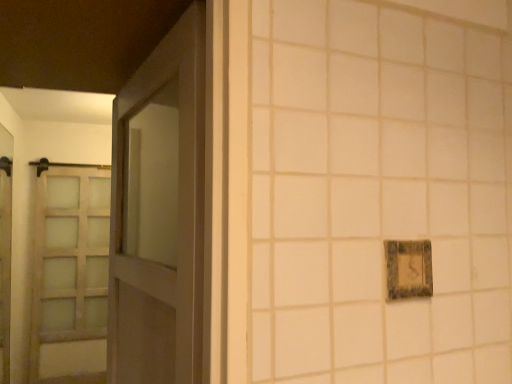
Question: From the image's perspective, would you say rustic stone picture frame at right is positioned over matte glass elevator at left?

Choices:
 (A) no
 (B) yes

Answer: (B)

Question: Is rustic stone picture frame at right not near matte glass elevator at left?

Choices:
 (A) no
 (B) yes

Answer: (B)

Question: Considering the relative sizes of rustic stone picture frame at right and matte glass elevator at left in the image provided, is rustic stone picture frame at right thinner than matte glass elevator at left?

Choices:
 (A) yes
 (B) no

Answer: (A)

Question: From a real-world perspective, is rustic stone picture frame at right below matte glass elevator at left?

Choices:
 (A) yes
 (B) no

Answer: (B)

Question: Is rustic stone picture frame at right further to camera compared to matte glass elevator at left?

Choices:
 (A) no
 (B) yes

Answer: (A)

Question: Can you confirm if rustic stone picture frame at right is shorter than matte glass elevator at left?

Choices:
 (A) no
 (B) yes

Answer: (B)

Question: Is matte wood door at left outside of matte glass elevator at left?

Choices:
 (A) yes
 (B) no

Answer: (A)

Question: Can you confirm if matte wood door at left is wider than matte glass elevator at left?

Choices:
 (A) yes
 (B) no

Answer: (A)

Question: Considering the relative sizes of matte wood door at left and matte glass elevator at left in the image provided, is matte wood door at left taller than matte glass elevator at left?

Choices:
 (A) yes
 (B) no

Answer: (B)

Question: Can you confirm if matte wood door at left is positioned to the left of matte glass elevator at left?

Choices:
 (A) yes
 (B) no

Answer: (B)

Question: From the image's perspective, is matte wood door at left located beneath matte glass elevator at left?

Choices:
 (A) yes
 (B) no

Answer: (B)

Question: Is matte wood door at left shorter than matte glass elevator at left?

Choices:
 (A) no
 (B) yes

Answer: (B)

Question: From the image's perspective, would you say matte glass elevator at left is shown under satin wood barn door at left?

Choices:
 (A) yes
 (B) no

Answer: (B)